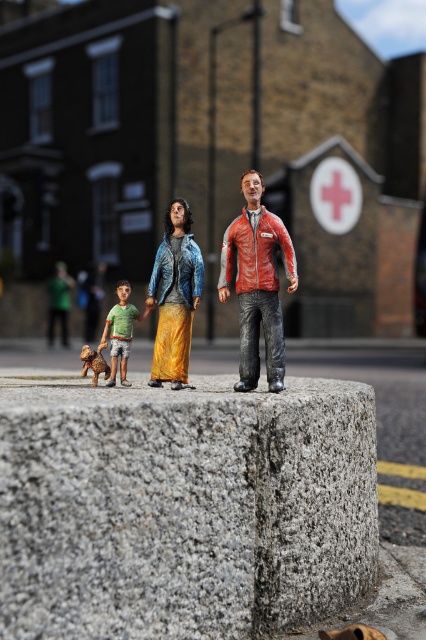
Which of these two, leather jacket at center or brown fur dog at lower left, stands shorter?

Standing shorter between the two is brown fur dog at lower left.

Can you confirm if leather jacket at center is wider than brown fur dog at lower left?

Yes.

At what (x,y) coordinates should I click in order to perform the action: click on leather jacket at center. Please return your answer as a coordinate pair (x, y). The width and height of the screenshot is (426, 640). Looking at the image, I should click on (258, 284).

Describe the element at coordinates (258, 284) in the screenshot. I see `leather jacket at center` at that location.

Measure the distance between leather jacket at center and green cotton shirt at center.

The distance of leather jacket at center from green cotton shirt at center is 16.42 inches.

Locate an element on the screen. This screenshot has width=426, height=640. leather jacket at center is located at coordinates (258, 284).

Identify the location of leather jacket at center. The image size is (426, 640). (x=258, y=284).

Does green cotton shirt at center have a greater height compared to brown fur dog at lower left?

Yes.

Which is more to the left, green cotton shirt at center or brown fur dog at lower left?

brown fur dog at lower left is more to the left.

Who is more forward, (115,371) or (98,369)?

Point (98,369) is in front.

You are a GUI agent. You are given a task and a screenshot of the screen. Output one action in this format:
    pyautogui.click(x=<x>, y=<y>)
    Task: Click on the green cotton shirt at center
    
    Given the screenshot: What is the action you would take?
    (x=121, y=330)